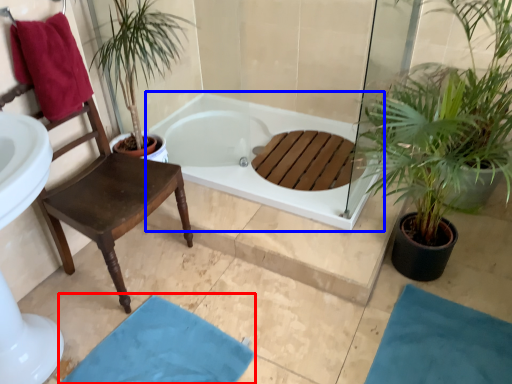
Question: Which of the following is the farthest to the observer, bath mat (highlighted by a red box) or bathtub (highlighted by a blue box)?

Choices:
 (A) bath mat
 (B) bathtub

Answer: (B)